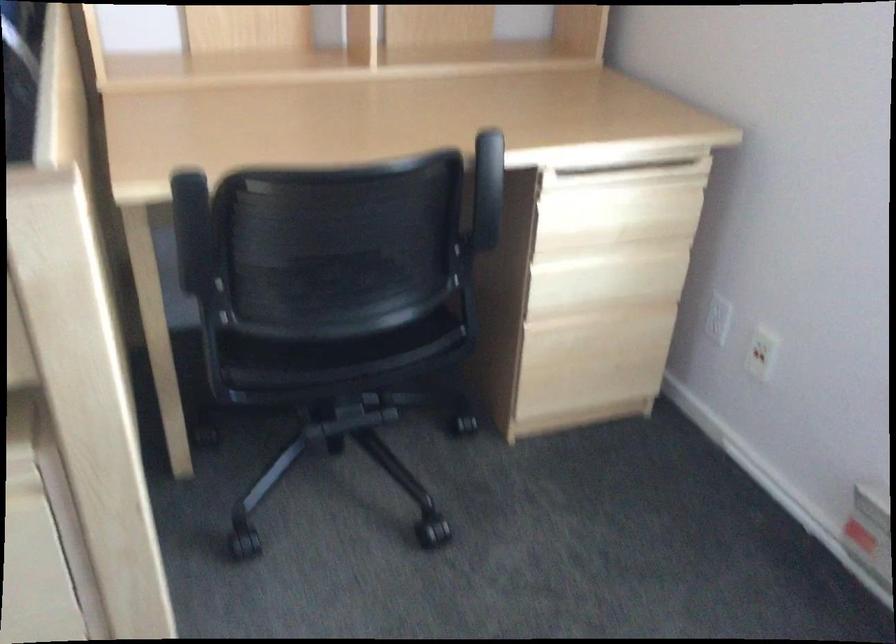
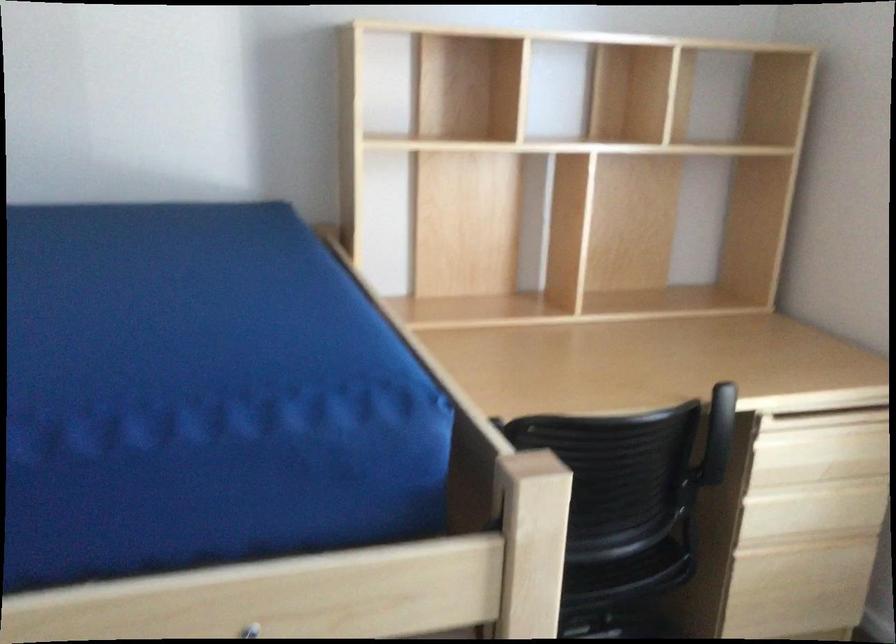
Question: Based on the continuous images, in which direction is the camera rotating? Reply with the corresponding letter.

Choices:
 (A) Left
 (B) Right
 (C) Up
 (D) Down

Answer: (C)